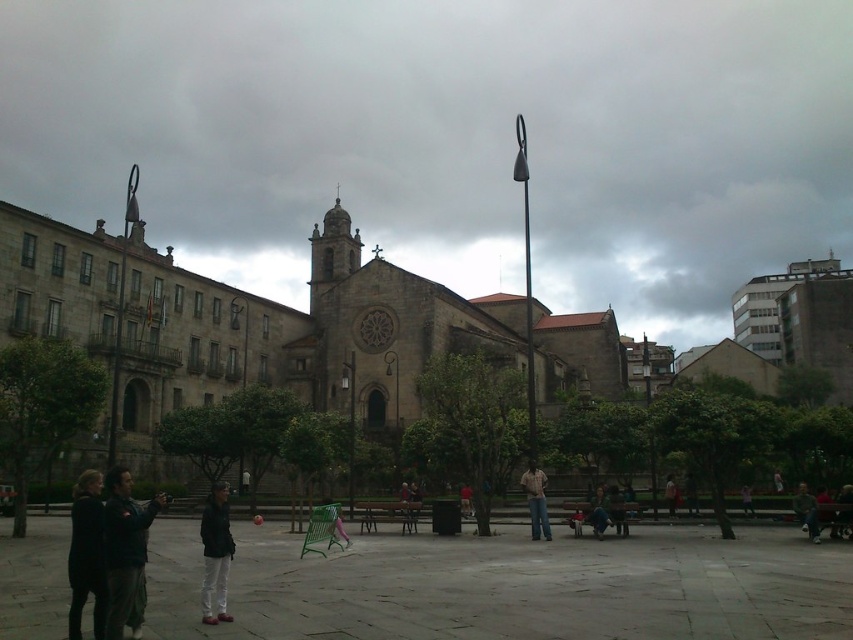
You are a photographer planning to capture a wide shot of the gray stone church at center and the dark gray jacket at lower left. Based on their sizes, which object will occupy more space in the photo?

The gray stone church at center will occupy more space in the photo because its width surpasses that of the dark gray jacket at lower left.

You are standing in the public square and want to locate the point at coordinates (x=242, y=324). According to the scene, where exactly would this point be located?

The point at coordinates (x=242, y=324) is on the gray stone church at center.

You are standing in the public square and want to take a photo of the point located at coordinates (152, 432). Considering the distance, will this point be in focus if your camera has a depth of field that can sharply capture objects up to 80 meters away?

The point at coordinates (152, 432) is 76.76 meters away from the camera. Since the depth of field can capture up to 80 meters, the point will be within the sharp focus range.